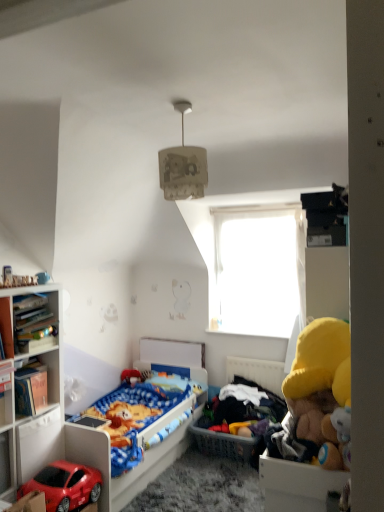
Question: Is wooden bookshelf at left, the second cabinet when ordered from left to right, wider than matte plastic bed at lower left?

Choices:
 (A) yes
 (B) no

Answer: (B)

Question: Is matte plastic bed at lower left inside wooden bookshelf at left, which ranks as the 2th cabinet in right-to-left order?

Choices:
 (A) yes
 (B) no

Answer: (B)

Question: Could you tell me if wooden bookshelf at left, which ranks as the 2th cabinet in right-to-left order, is turned towards matte plastic bed at lower left?

Choices:
 (A) yes
 (B) no

Answer: (B)

Question: Considering the relative sizes of wooden bookshelf at left, which appears as the 2th cabinet when viewed from the front, and matte plastic bed at lower left in the image provided, is wooden bookshelf at left, which appears as the 2th cabinet when viewed from the front, taller than matte plastic bed at lower left?

Choices:
 (A) yes
 (B) no

Answer: (B)

Question: Is the position of wooden bookshelf at left, the second cabinet when ordered from left to right, more distant than that of matte plastic bed at lower left?

Choices:
 (A) yes
 (B) no

Answer: (B)

Question: Based on their sizes in the image, would you say transparent plastic window at upper center is bigger or smaller than wooden bookshelf at left, which ranks as the 2th cabinet in right-to-left order?

Choices:
 (A) big
 (B) small

Answer: (A)

Question: From their relative heights in the image, would you say transparent plastic window at upper center is taller or shorter than wooden bookshelf at left, which ranks as the 2th cabinet in right-to-left order?

Choices:
 (A) short
 (B) tall

Answer: (B)

Question: From the image's perspective, is transparent plastic window at upper center above or below wooden bookshelf at left, which is counted as the second cabinet, starting from the back?

Choices:
 (A) below
 (B) above

Answer: (B)

Question: In the image, is transparent plastic window at upper center positioned in front of or behind wooden bookshelf at left, the second cabinet when ordered from left to right?

Choices:
 (A) front
 (B) behind

Answer: (B)

Question: In terms of size, does plastic basket at center appear bigger or smaller than matte plastic bed at lower left?

Choices:
 (A) big
 (B) small

Answer: (B)

Question: In terms of height, does plastic basket at center look taller or shorter compared to matte plastic bed at lower left?

Choices:
 (A) tall
 (B) short

Answer: (B)

Question: From a real-world perspective, relative to matte plastic bed at lower left, is plastic basket at center vertically above or below?

Choices:
 (A) above
 (B) below

Answer: (A)

Question: Choose the correct answer: Is plastic basket at center inside matte plastic bed at lower left or outside it?

Choices:
 (A) outside
 (B) inside

Answer: (A)

Question: Is white paper lampshade at upper center to the left or to the right of wooden bookshelf at left, the second cabinet when ordered from left to right, in the image?

Choices:
 (A) left
 (B) right

Answer: (B)

Question: From the image's perspective, is white paper lampshade at upper center positioned above or below wooden bookshelf at left, the second cabinet when ordered from left to right?

Choices:
 (A) above
 (B) below

Answer: (A)